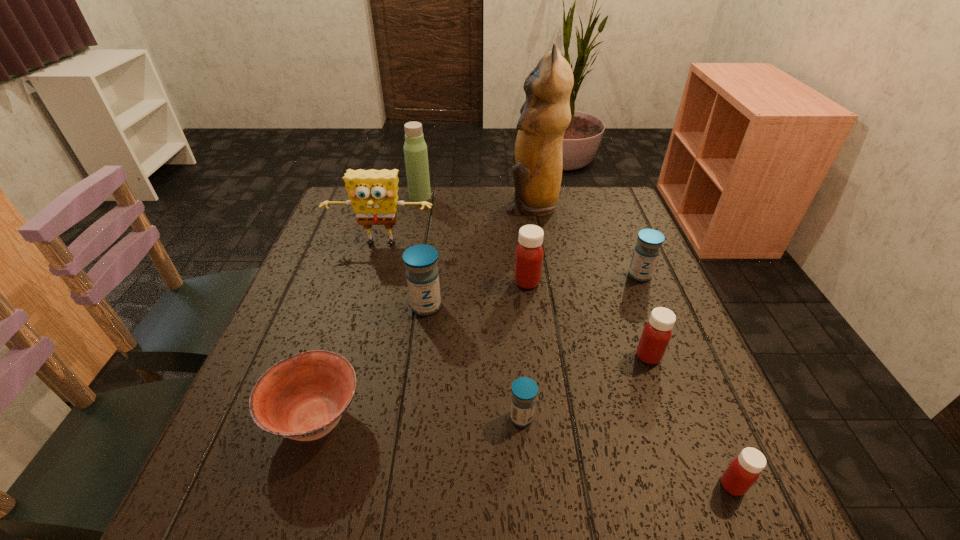
Choose which medicine is the second nearest neighbor to the yellow sponge. Please provide its 2D coordinates. Your answer should be formatted as a tuple, i.e. [(x, y)], where the tuple contains the x and y coordinates of a point satisfying the conditions above.

[(529, 253)]

Select which medicine appears as the fourth closest to the second smallest blue medicine. Please provide its 2D coordinates. Your answer should be formatted as a tuple, i.e. [(x, y)], where the tuple contains the x and y coordinates of a point satisfying the conditions above.

[(422, 274)]

Identify the location of red medicine that is the second closest to the second blue medicine from right to left. The width and height of the screenshot is (960, 540). (744, 470).

Find the location of a particular element. The width and height of the screenshot is (960, 540). red medicine that stands as the closest to the farthest red medicine is located at coordinates (656, 334).

Locate an element on the screen. the closest blue medicine to the nearest medicine is located at coordinates (524, 390).

What are the coordinates of `blue medicine that is the second nearest to the second farthest blue medicine` in the screenshot? It's located at (646, 252).

Find the location of `vacant point that satisfies the following two spatial constraints: 1. on the face of the nearest object; 2. on the left side of the cat`. vacant point that satisfies the following two spatial constraints: 1. on the face of the nearest object; 2. on the left side of the cat is located at coordinates (579, 485).

Where is `vacant area that satisfies the following two spatial constraints: 1. on the face of the tallest object; 2. on the face of the sponge`? This screenshot has height=540, width=960. vacant area that satisfies the following two spatial constraints: 1. on the face of the tallest object; 2. on the face of the sponge is located at coordinates (539, 245).